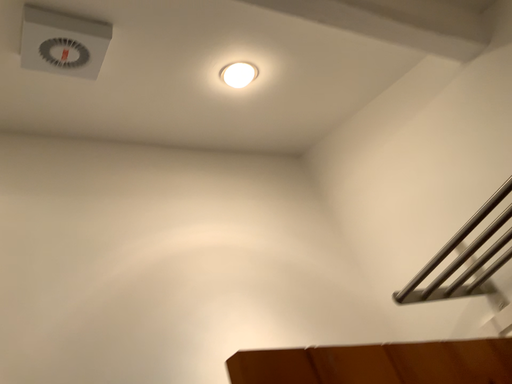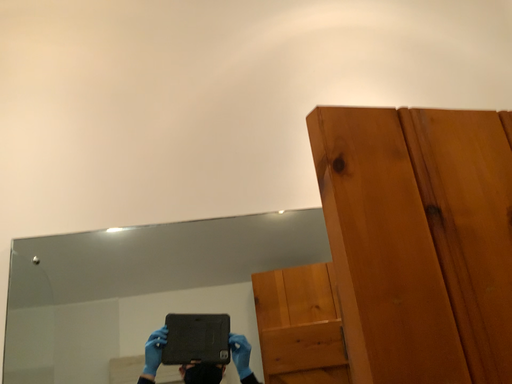
Question: How did the camera likely rotate when shooting the video?

Choices:
 (A) rotated downward
 (B) rotated upward

Answer: (A)